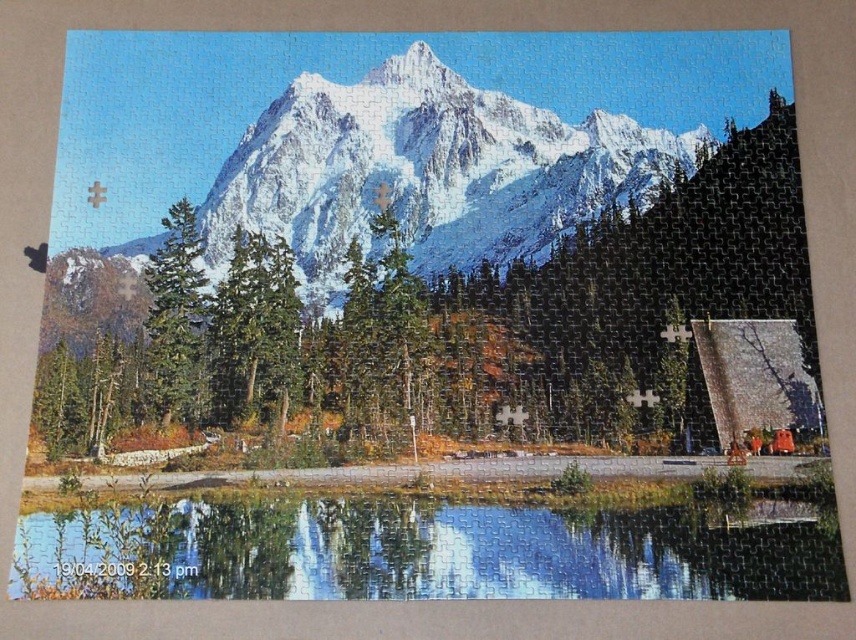
You are standing at the base of the mountain in the image and want to reach the transparent glass water at lower center. The green matte tree at center is blocking your path. Can you walk around the tree to reach the water without crossing through the forest?

The green matte tree at center is 37.92 feet away from transparent glass water at lower center. Since the tree is blocking the path, you can walk around it to reach the water without entering the forest, as the distance allows enough space for maneuvering.

You are examining the mountain landscape puzzle and notice two points marked on the puzzle. The first point is at coordinate point(56,390) and the second is at point(164,220). Which of these points is closer to the front of the puzzle?

Point(56,390) is closer to the viewer than point(164,220), so it is the point closer to the front of the puzzle.